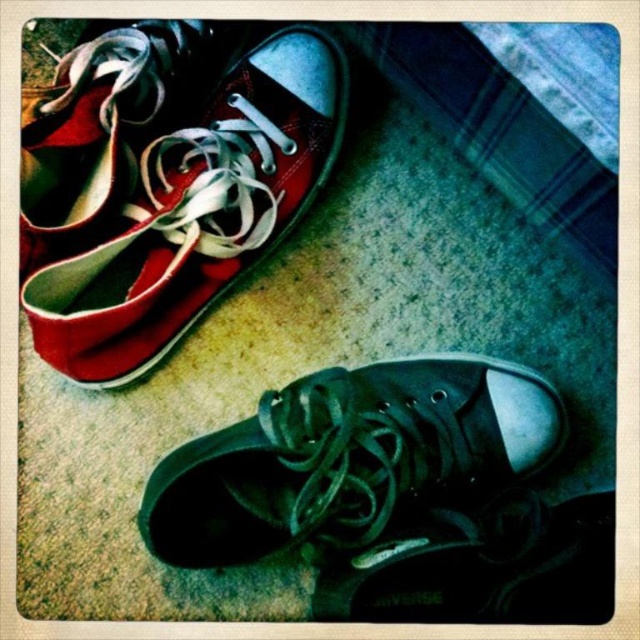
Can you confirm if matte canvas shoe at upper left is thinner than matte white/red canvas shoe at upper left?

Incorrect, matte canvas shoe at upper left's width is not less than matte white/red canvas shoe at upper left's.

Is matte canvas shoe at upper left bigger than matte white/red canvas shoe at upper left?

Correct, matte canvas shoe at upper left is larger in size than matte white/red canvas shoe at upper left.

Is point (196, 141) behind point (84, 129)?

Yes, it is.

Locate an element on the screen. The width and height of the screenshot is (640, 640). matte canvas shoe at upper left is located at coordinates (164, 182).

Does matte canvas shoe at upper left have a greater height compared to matte black sneaker at bottom right?

Yes.

Does matte canvas shoe at upper left have a lesser height compared to matte black sneaker at bottom right?

No.

Who is more forward, (189, 20) or (349, 467)?

Point (349, 467)

Find the location of a particular element. The width and height of the screenshot is (640, 640). matte canvas shoe at upper left is located at coordinates (164, 182).

Does matte black sneaker at bottom right appear on the right side of matte white/red canvas shoe at upper left?

Yes, matte black sneaker at bottom right is to the right of matte white/red canvas shoe at upper left.

Is matte black sneaker at bottom right positioned at the back of matte white/red canvas shoe at upper left?

Yes.

What do you see at coordinates (349, 460) in the screenshot? I see `matte black sneaker at bottom right` at bounding box center [349, 460].

Image resolution: width=640 pixels, height=640 pixels. In order to click on matte black sneaker at bottom right in this screenshot , I will do `click(349, 460)`.